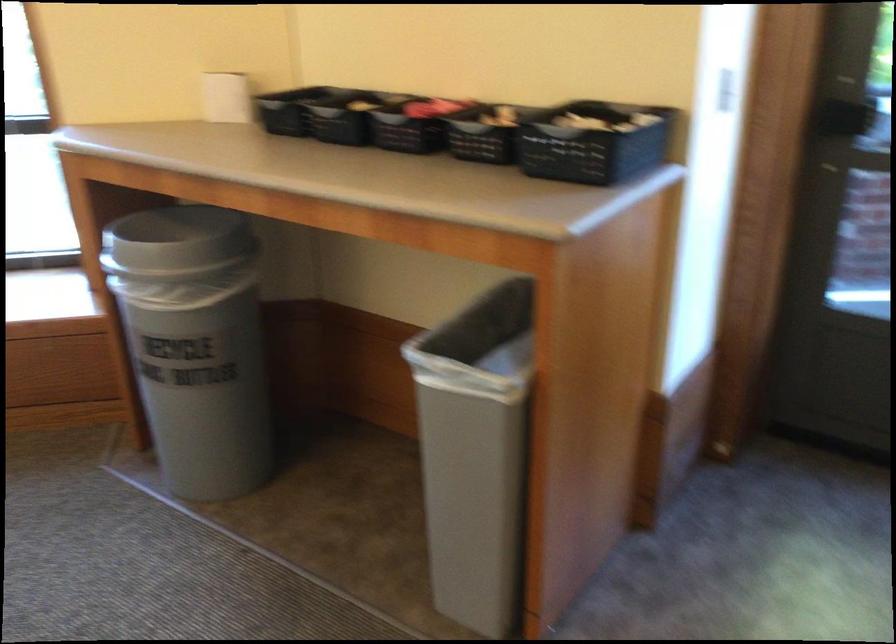
Which object does [194,344] point to?

This point indicates the gray trash can.